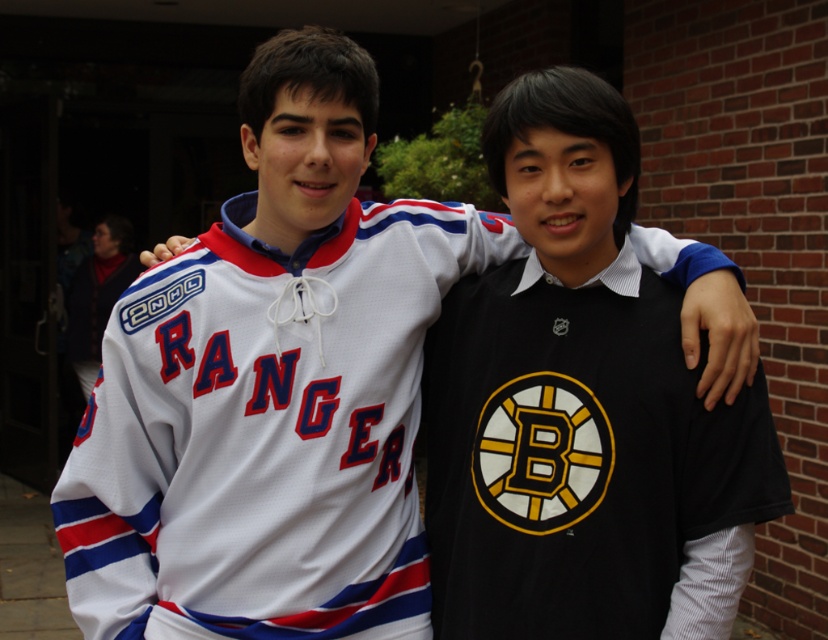
Question: Among these objects, which one is nearest to the camera?

Choices:
 (A) black jersey at center
 (B) white jersey at center

Answer: (A)

Question: Does black jersey at center appear on the left side of white jersey at center?

Choices:
 (A) no
 (B) yes

Answer: (A)

Question: Does black jersey at center appear on the right side of white jersey at center?

Choices:
 (A) no
 (B) yes

Answer: (B)

Question: Which object appears closest to the camera in this image?

Choices:
 (A) black jersey at center
 (B) white jersey at center

Answer: (A)

Question: Is black jersey at center to the right of white jersey at center from the viewer's perspective?

Choices:
 (A) yes
 (B) no

Answer: (A)